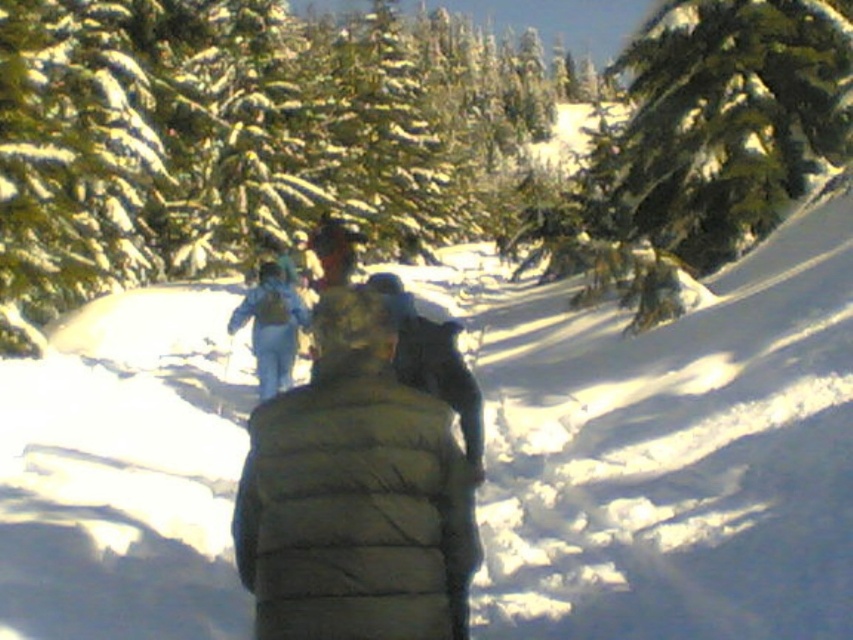
Question: Can you confirm if green textured pine tree at center is wider than green textured pine tree at upper right?

Choices:
 (A) no
 (B) yes

Answer: (B)

Question: Among these points, which one is nearest to the camera?

Choices:
 (A) (12, 65)
 (B) (633, 76)
 (C) (366, 531)

Answer: (C)

Question: Which of the following is the closest to the observer?

Choices:
 (A) green textured pine tree at center
 (B) green puffy jacket at center
 (C) green textured pine tree at upper right

Answer: (B)

Question: Can you confirm if green textured pine tree at upper right is positioned above green puffy jacket at center?

Choices:
 (A) no
 (B) yes

Answer: (B)

Question: Which point appears farthest from the camera in this image?

Choices:
 (A) (611, 209)
 (B) (299, 595)
 (C) (252, 17)

Answer: (C)

Question: Does green textured pine tree at upper right appear under green puffy jacket at center?

Choices:
 (A) yes
 (B) no

Answer: (B)